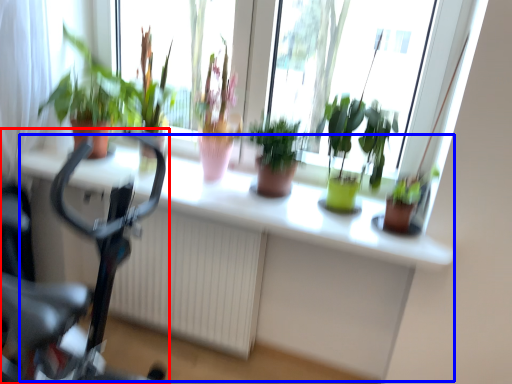
Question: Which point is further to the camera, bicycle (highlighted by a red box) or computer desk (highlighted by a blue box)?

Choices:
 (A) bicycle
 (B) computer desk

Answer: (A)